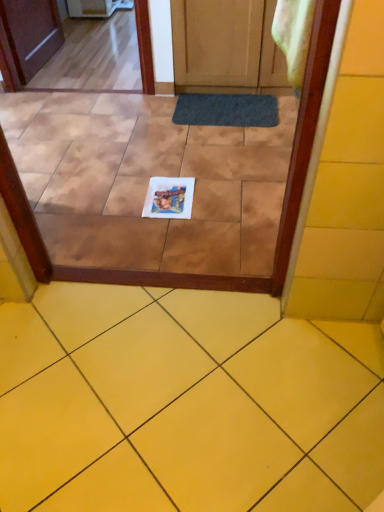
Locate an element on the screen. vacant space underneath dark gray rubber doormat at center (from a real-world perspective) is located at coordinates (226, 113).